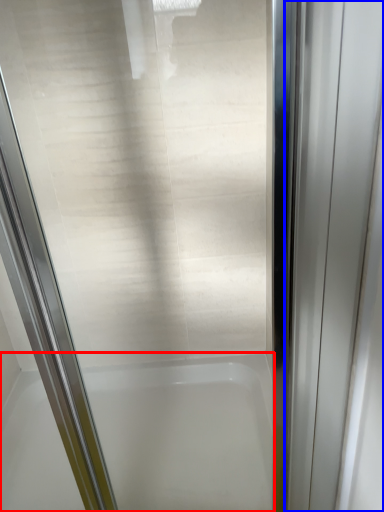
Question: Which object appears closest to the camera in this image, bathtub (highlighted by a red box) or elevator door (highlighted by a blue box)?

Choices:
 (A) bathtub
 (B) elevator door

Answer: (B)